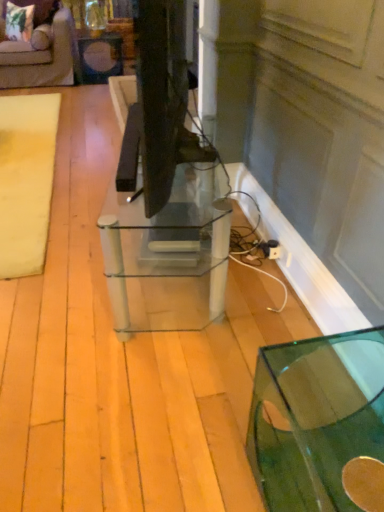
The height and width of the screenshot is (512, 384). Describe the element at coordinates (100, 57) in the screenshot. I see `matte black side table at upper left` at that location.

The width and height of the screenshot is (384, 512). Find the location of `transparent glass table at lower right, acting as the 2th table starting from the left`. transparent glass table at lower right, acting as the 2th table starting from the left is located at coordinates (315, 418).

Identify the location of matte black side table at upper left. (100, 57).

From the image's perspective, is clear glass table at center, arranged as the first table when viewed from the left, located beneath matte black side table at upper left?

Indeed, from the image's perspective, clear glass table at center, arranged as the first table when viewed from the left, is shown beneath matte black side table at upper left.

Is matte black side table at upper left located within clear glass table at center, which ranks as the first table in top-to-bottom order?

No, matte black side table at upper left is located outside of clear glass table at center, which ranks as the first table in top-to-bottom order.

Is clear glass table at center, arranged as the first table when viewed from the left, thinner than matte black side table at upper left?

Indeed, clear glass table at center, arranged as the first table when viewed from the left, has a lesser width compared to matte black side table at upper left.

From a real-world perspective, which object rests below the other?

In real-world perspective, matte black side table at upper left is lower.

Is clear glass table at center, arranged as the second table when viewed from the front, positioned with its back to beige fabric mat at left?

clear glass table at center, arranged as the second table when viewed from the front, does not have its back to beige fabric mat at left.

From the picture: Can you see clear glass table at center, which ranks as the first table in top-to-bottom order, touching beige fabric mat at left?

clear glass table at center, which ranks as the first table in top-to-bottom order, is not next to beige fabric mat at left, and they're not touching.

Consider the image. Is beige fabric mat at left surrounded by clear glass table at center, arranged as the second table when viewed from the front?

Actually, beige fabric mat at left is outside clear glass table at center, arranged as the second table when viewed from the front.

Is clear glass table at center, marked as the second table in a right-to-left arrangement, in front of beige fabric mat at left?

Yes, clear glass table at center, marked as the second table in a right-to-left arrangement, is closer to the camera.

Which object is more forward, transparent glass table at lower right, acting as the 2th table starting from the left, or matte black side table at upper left?

Positioned in front is transparent glass table at lower right, acting as the 2th table starting from the left.

Measure the distance from transparent glass table at lower right, the 2th table positioned from the top, to matte black side table at upper left.

transparent glass table at lower right, the 2th table positioned from the top, is 4.51 meters from matte black side table at upper left.

From the image's perspective, is transparent glass table at lower right, marked as the 1th table in a front-to-back arrangement, above matte black side table at upper left?

No, from the image's perspective, transparent glass table at lower right, marked as the 1th table in a front-to-back arrangement, is not on top of matte black side table at upper left.

Is matte black side table at upper left at the back of transparent glass table at lower right, the 2th table positioned from the top?

transparent glass table at lower right, the 2th table positioned from the top, is not turned away from matte black side table at upper left.

Does matte black side table at upper left turn towards clear glass table at center, arranged as the first table when viewed from the left?

Yes, matte black side table at upper left faces towards clear glass table at center, arranged as the first table when viewed from the left.

Is point (98, 60) positioned before point (176, 273)?

No, it is not.

The width and height of the screenshot is (384, 512). Find the location of `table that is the 2nd one above the matte black side table at upper left (from a real-world perspective)`. table that is the 2nd one above the matte black side table at upper left (from a real-world perspective) is located at coordinates (167, 256).

This screenshot has height=512, width=384. Identify the location of side table behind the beige fabric mat at left. (100, 57).

Can you confirm if matte black side table at upper left is positioned to the right of beige fabric mat at left?

Yes.

Considering the sizes of objects matte black side table at upper left and beige fabric mat at left in the image provided, who is wider, matte black side table at upper left or beige fabric mat at left?

With larger width is beige fabric mat at left.

Is matte black side table at upper left in front of beige fabric mat at left?

No, it is behind beige fabric mat at left.

Does velvet beige sofa at upper left touch matte black side table at upper left?

No, velvet beige sofa at upper left is not beside matte black side table at upper left.

Does velvet beige sofa at upper left lie in front of matte black side table at upper left?

Yes, it is in front of matte black side table at upper left.

The image size is (384, 512). What are the coordinates of `side table below the velvet beige sofa at upper left (from the image's perspective)` in the screenshot? It's located at (100, 57).

Is velvet beige sofa at upper left positioned with its back to matte black side table at upper left?

No, velvet beige sofa at upper left is not facing the opposite direction of matte black side table at upper left.

Can you tell me how much velvet beige sofa at upper left and transparent glass table at lower right, arranged as the first table when viewed from the right, differ in facing direction?

89.6 degrees.

Between velvet beige sofa at upper left and transparent glass table at lower right, the 2th table positioned from the top, which one has larger size?

velvet beige sofa at upper left is bigger.

Which object is thinner, velvet beige sofa at upper left or transparent glass table at lower right, arranged as the first table when viewed from the right?

With smaller width is transparent glass table at lower right, arranged as the first table when viewed from the right.

Would you say velvet beige sofa at upper left contains transparent glass table at lower right, the 2th table positioned from the top?

Actually, transparent glass table at lower right, the 2th table positioned from the top, is outside velvet beige sofa at upper left.

This screenshot has height=512, width=384. In order to click on side table lying on the left of clear glass table at center, which ranks as the first table in top-to-bottom order in this screenshot , I will do `click(100, 57)`.

This screenshot has height=512, width=384. Identify the location of the 2nd table directly above the beige fabric mat at left (from a real-world perspective). (167, 256).

Estimate the real-world distances between objects in this image. Which object is closer to transparent glass table at lower right, arranged as the 1th table when ordered from the bottom, clear glass table at center, marked as the second table in a right-to-left arrangement, or velvet beige sofa at upper left?

clear glass table at center, marked as the second table in a right-to-left arrangement, is closer to transparent glass table at lower right, arranged as the 1th table when ordered from the bottom.

Estimate the real-world distances between objects in this image. Which object is closer to transparent glass table at lower right, arranged as the first table when viewed from the right, matte black side table at upper left or velvet beige sofa at upper left?

matte black side table at upper left is closer to transparent glass table at lower right, arranged as the first table when viewed from the right.

Considering their positions, is clear glass table at center, arranged as the second table when viewed from the front, positioned further to velvet beige sofa at upper left than matte black side table at upper left?

The object further to velvet beige sofa at upper left is clear glass table at center, arranged as the second table when viewed from the front.

Which object lies further to the anchor point matte black side table at upper left, beige fabric mat at left or velvet beige sofa at upper left?

The object further to matte black side table at upper left is beige fabric mat at left.

Estimate the real-world distances between objects in this image. Which object is further from beige fabric mat at left, clear glass table at center, which ranks as the first table in top-to-bottom order, or matte black side table at upper left?

Among the two, matte black side table at upper left is located further to beige fabric mat at left.

Estimate the real-world distances between objects in this image. Which object is further from beige fabric mat at left, matte black side table at upper left or clear glass table at center, which ranks as the first table in top-to-bottom order?

Among the two, matte black side table at upper left is located further to beige fabric mat at left.

Looking at this image, estimate the real-world distances between objects in this image. Which object is closer to matte black side table at upper left, clear glass table at center, arranged as the second table when viewed from the front, or transparent glass table at lower right, marked as the second table in a back-to-front arrangement?

The object closer to matte black side table at upper left is clear glass table at center, arranged as the second table when viewed from the front.

Looking at the image, which one is located closer to beige fabric mat at left, transparent glass table at lower right, the 2th table positioned from the top, or velvet beige sofa at upper left?

velvet beige sofa at upper left is closer to beige fabric mat at left.

Identify the location of table between transparent glass table at lower right, acting as the 2th table starting from the left, and matte black side table at upper left from front to back. The width and height of the screenshot is (384, 512). (167, 256).

Find the location of a particular element. furniture located between clear glass table at center, marked as the second table in a right-to-left arrangement, and matte black side table at upper left in the depth direction is located at coordinates (42, 56).

Locate an element on the screen. furniture between beige fabric mat at left and matte black side table at upper left in the front-back direction is located at coordinates (42, 56).

At what (x,y) coordinates should I click in order to perform the action: click on furniture between transparent glass table at lower right, acting as the 2th table starting from the left, and matte black side table at upper left, along the z-axis. Please return your answer as a coordinate pair (x, y). The image size is (384, 512). Looking at the image, I should click on (42, 56).